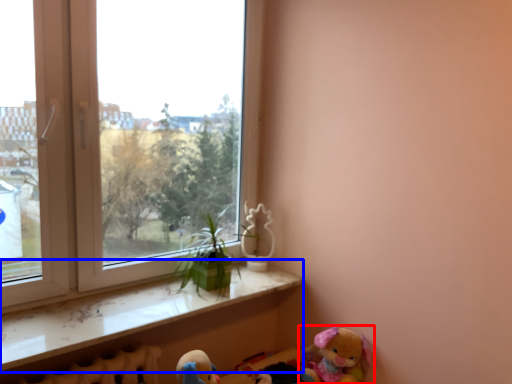
Question: Which point is closer to the camera, toy (highlighted by a red box) or window sill (highlighted by a blue box)?

Choices:
 (A) toy
 (B) window sill

Answer: (B)